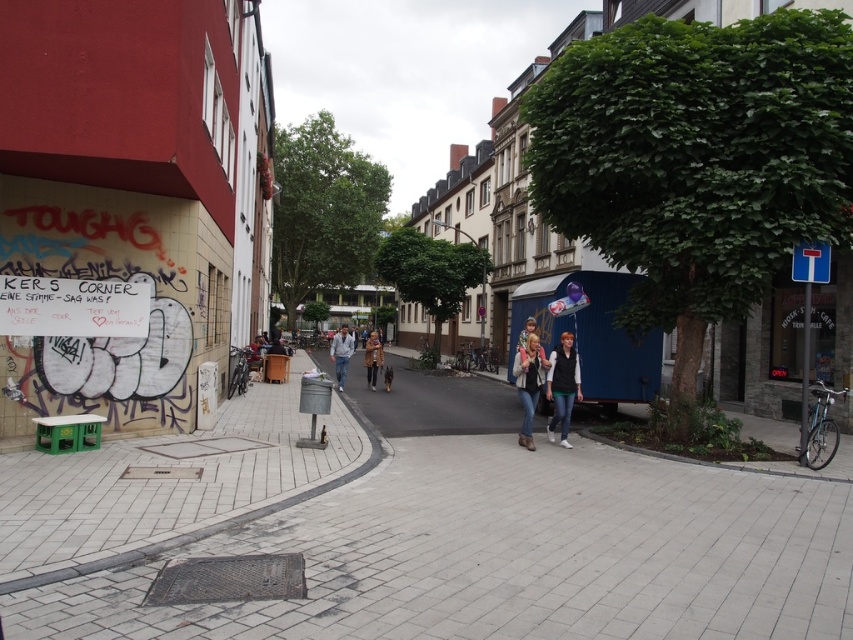
Question: Can you confirm if denim jeans at lower right is positioned to the left of light blue jeans at center?

Choices:
 (A) yes
 (B) no

Answer: (B)

Question: Where is denim jeans at lower right located in relation to denim jeans at center in the image?

Choices:
 (A) below
 (B) above

Answer: (A)

Question: Which point is farther to the camera?

Choices:
 (A) light blue jeans at center
 (B) denim jeans at lower right
 (C) brown leather jacket at center

Answer: (C)

Question: Which object is farther from the camera taking this photo?

Choices:
 (A) denim jeans at center
 (B) light blue jeans at center

Answer: (B)

Question: Which point is farther from the camera taking this photo?

Choices:
 (A) (578, 384)
 (B) (635, 472)

Answer: (A)

Question: Does light blue jeans at center have a greater width compared to brown leather jacket at center?

Choices:
 (A) no
 (B) yes

Answer: (B)